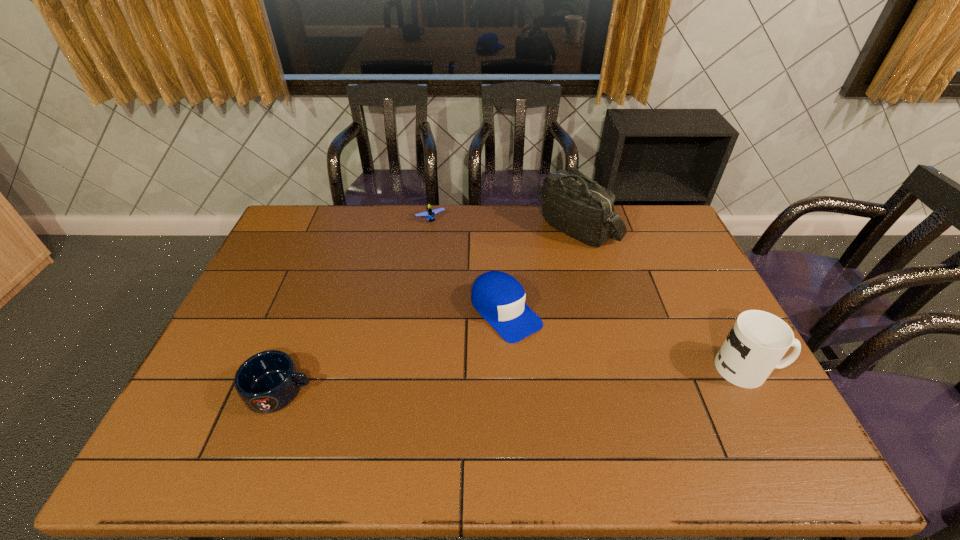
This screenshot has width=960, height=540. I want to click on the shorter mug, so click(268, 381).

Identify the location of the leftmost object. This screenshot has width=960, height=540. (268, 381).

Identify the location of the second tallest object. The image size is (960, 540). (758, 340).

You are a GUI agent. You are given a task and a screenshot of the screen. Output one action in this format:
    pyautogui.click(x=<x>, y=<y>)
    Task: Click on the taller mug
    This screenshot has height=540, width=960.
    Given the screenshot: What is the action you would take?
    pyautogui.click(x=758, y=340)

You are a GUI agent. You are given a task and a screenshot of the screen. Output one action in this format:
    pyautogui.click(x=<x>, y=<y>)
    Task: Click on the third object from right to left
    The width and height of the screenshot is (960, 540).
    Given the screenshot: What is the action you would take?
    pyautogui.click(x=499, y=298)

At what (x,y) coordinates should I click in order to perform the action: click on the third nearest object. Please return your answer as a coordinate pair (x, y). The image size is (960, 540). Looking at the image, I should click on (499, 298).

You are a GUI agent. You are given a task and a screenshot of the screen. Output one action in this format:
    pyautogui.click(x=<x>, y=<y>)
    Task: Click on the fourth object from left to right
    The height and width of the screenshot is (540, 960).
    Given the screenshot: What is the action you would take?
    pyautogui.click(x=572, y=203)

Identify the location of the tallest object. (572, 203).

Find the location of a particular element. This screenshot has width=960, height=540. Lego is located at coordinates click(x=429, y=214).

This screenshot has width=960, height=540. What are the coordinates of `the fourth object from right to left` in the screenshot? It's located at (429, 214).